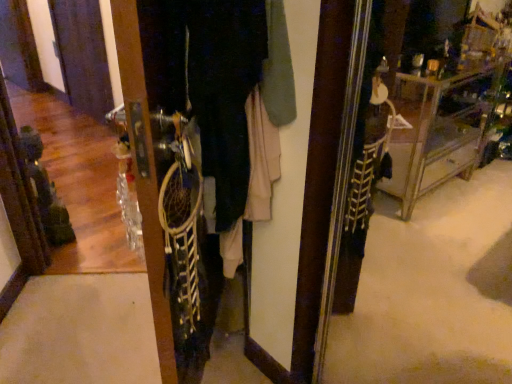
Question: Is matte black screen door at left not inside white fabric dreamcatcher at center?

Choices:
 (A) yes
 (B) no

Answer: (A)

Question: Can you confirm if matte black screen door at left is wider than white fabric dreamcatcher at center?

Choices:
 (A) no
 (B) yes

Answer: (A)

Question: Would you consider matte black screen door at left to be distant from white fabric dreamcatcher at center?

Choices:
 (A) yes
 (B) no

Answer: (A)

Question: Is matte black screen door at left oriented towards white fabric dreamcatcher at center?

Choices:
 (A) yes
 (B) no

Answer: (B)

Question: Is matte black screen door at left at the right side of white fabric dreamcatcher at center?

Choices:
 (A) no
 (B) yes

Answer: (A)

Question: From the image's perspective, does matte black screen door at left appear higher than white fabric dreamcatcher at center?

Choices:
 (A) no
 (B) yes

Answer: (B)

Question: Considering the relative sizes of white fabric dreamcatcher at center and matte black screen door at left in the image provided, is white fabric dreamcatcher at center thinner than matte black screen door at left?

Choices:
 (A) no
 (B) yes

Answer: (A)

Question: Is white fabric dreamcatcher at center not inside matte black screen door at left?

Choices:
 (A) no
 (B) yes

Answer: (B)

Question: Is white fabric dreamcatcher at center facing towards matte black screen door at left?

Choices:
 (A) no
 (B) yes

Answer: (A)

Question: Is white fabric dreamcatcher at center not close to matte black screen door at left?

Choices:
 (A) yes
 (B) no

Answer: (A)

Question: Does white fabric dreamcatcher at center appear on the right side of matte black screen door at left?

Choices:
 (A) yes
 (B) no

Answer: (A)

Question: Is matte black screen door at left a part of white fabric dreamcatcher at center?

Choices:
 (A) yes
 (B) no

Answer: (B)

Question: From the image's perspective, is white fabric dreamcatcher at center above or below matte black screen door at left?

Choices:
 (A) above
 (B) below

Answer: (B)